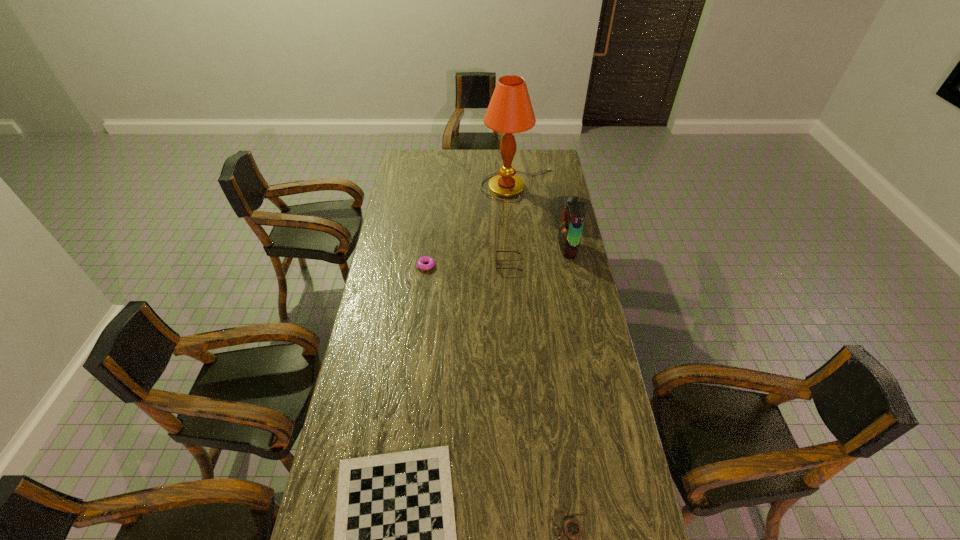
This screenshot has height=540, width=960. I want to click on lamp, so click(x=510, y=111).

Locate an element on the screen. The width and height of the screenshot is (960, 540). the tallest object is located at coordinates (510, 111).

The width and height of the screenshot is (960, 540). Find the location of `parrot`. parrot is located at coordinates (570, 231).

Where is `the fourth shortest object`? The width and height of the screenshot is (960, 540). the fourth shortest object is located at coordinates (496, 251).

This screenshot has height=540, width=960. I want to click on doughnut, so click(431, 262).

Image resolution: width=960 pixels, height=540 pixels. In order to click on vacant space situated 0.110m on the left of the lamp in this screenshot , I will do `click(460, 185)`.

Locate an element on the screen. This screenshot has height=540, width=960. vacant area situated 0.150m at the face of the parrot is located at coordinates (526, 247).

The image size is (960, 540). In order to click on vacant region located 0.180m at the face of the parrot in this screenshot , I will do `click(519, 247)`.

Find the location of a particular element. Image resolution: width=960 pixels, height=540 pixels. vacant area situated at the face of the parrot is located at coordinates (493, 247).

This screenshot has height=540, width=960. What are the coordinates of `vacant region located 0.320m on the front lenses of the sunglasses` in the screenshot? It's located at (423, 265).